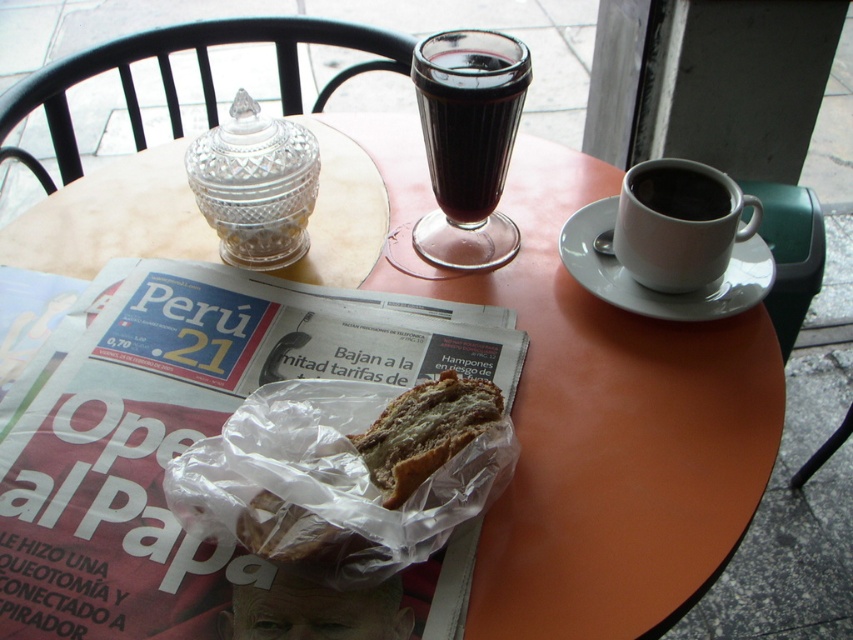
You are a customer at the cafe and want to grab your drinks. There are two cups on the table. The white glossy cup at upper right and the black matte cup at upper right. Which one is closer to the newspaper titled Per?u 21?

The white glossy cup at upper right is closer to the newspaper titled Per?u 21 because it is to the left of the black matte cup at upper right, and the newspaper is located to the left side of the cups.

You are a barista in the cafe and need to place a customer order. The customer ordered a coffee that requires a saucer and a cup. Looking at the white ceramic saucer at upper right and the black matte cup at upper right, will the cup fit on the saucer?

The white ceramic saucer at upper right is wider than the black matte cup at upper right, so the cup will fit on the saucer.